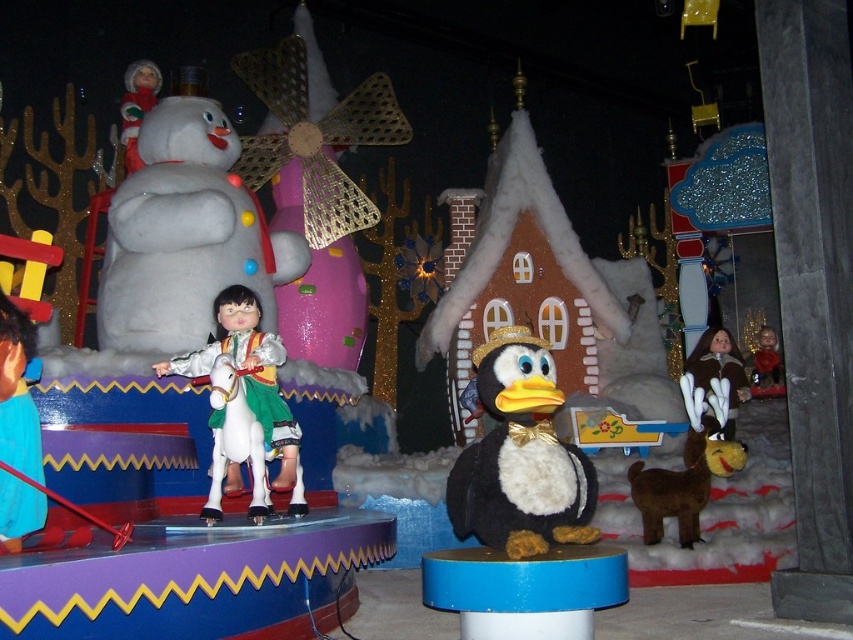
Is point (283, 476) more distant than point (764, 381)?

No.

Which is above, white glossy horse at center or smooth brown fur at center?

Positioned higher is smooth brown fur at center.

Which is behind, point (207, 371) or point (766, 385)?

The point (766, 385) is behind.

This screenshot has width=853, height=640. I want to click on white glossy horse at center, so click(x=251, y=385).

Is black plush penguin at center above brown furry coat at right?

Yes, black plush penguin at center is above brown furry coat at right.

Is black plush penguin at center below brown furry coat at right?

No.

Who is more distant from viewer, (469, 444) or (723, 344)?

Positioned behind is point (469, 444).

Locate an element on the screen. The image size is (853, 640). black plush penguin at center is located at coordinates (520, 456).

Between blue plastic stool at center and brown furry coat at right, which one is positioned lower?

blue plastic stool at center is below.

Looking at this image, is blue plastic stool at center thinner than brown furry coat at right?

No.

This screenshot has height=640, width=853. Identify the location of blue plastic stool at center. (525, 589).